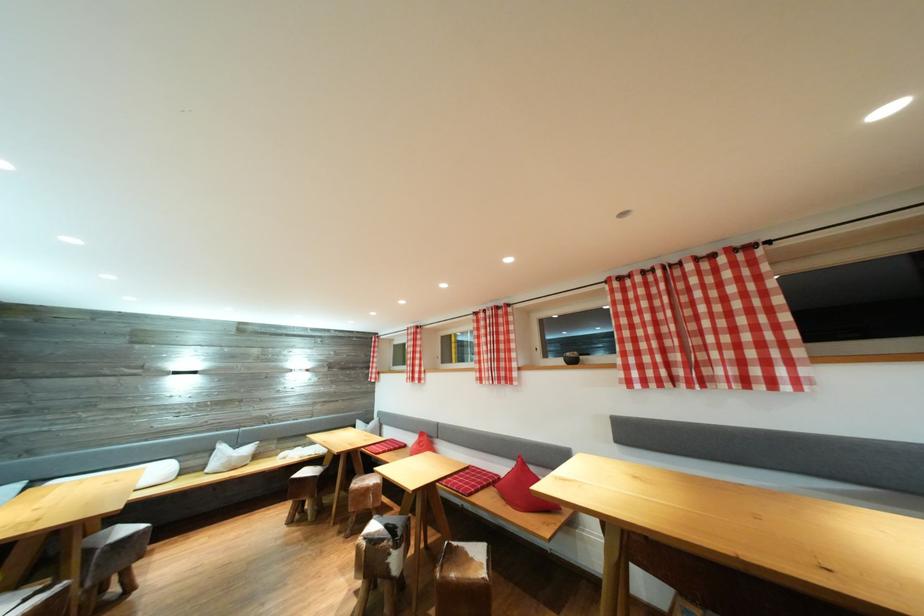
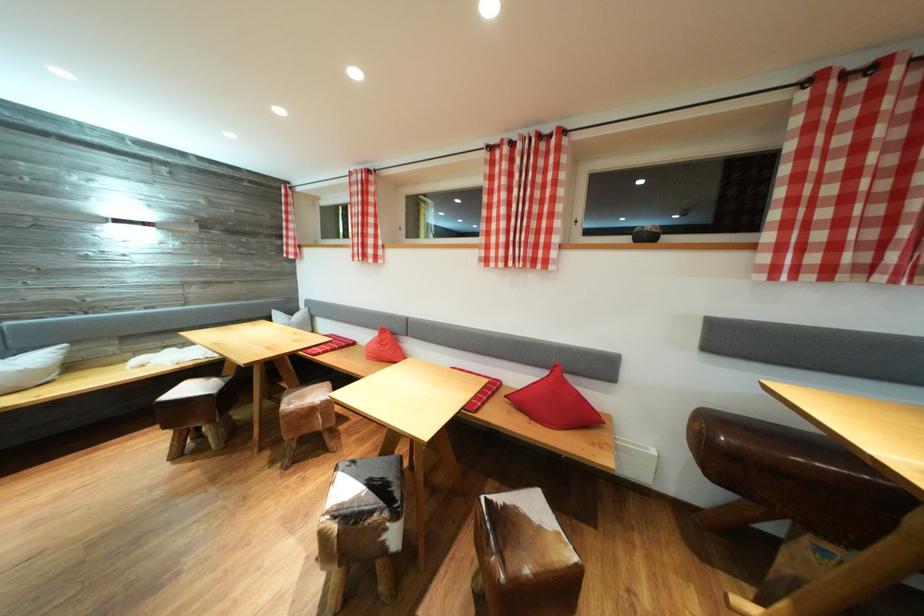
Where in the second image is the point corresponding to the point at 568,365 from the first image?

(638, 241)